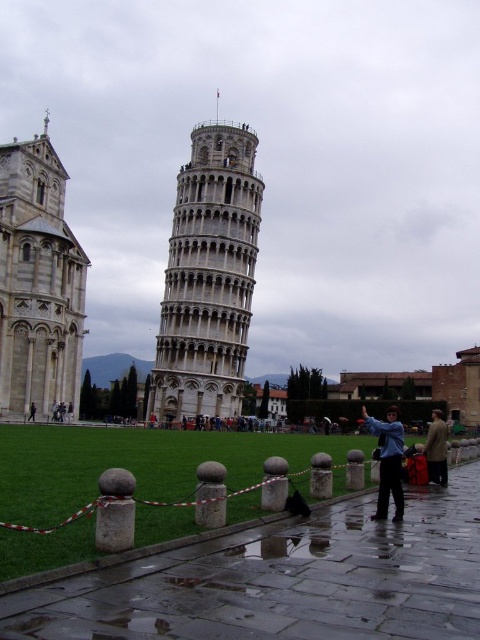
Can you confirm if stone tower at center is positioned to the right of dark blue jeans at center?

Yes, stone tower at center is to the right of dark blue jeans at center.

Which is above, stone tower at center or dark blue jeans at center?

Positioned higher is stone tower at center.

Locate an element on the screen. This screenshot has height=640, width=480. stone tower at center is located at coordinates (208, 276).

Between blue fabric jacket at center and dark blue jeans at center, which one is positioned higher?

Positioned higher is dark blue jeans at center.

Find the location of a particular element. This screenshot has width=480, height=640. blue fabric jacket at center is located at coordinates (387, 461).

Between point (384, 486) and point (35, 417), which one is positioned in front?

Point (384, 486) is in front.

Identify the location of blue fabric jacket at center. (387, 461).

Does stone tower at center come behind white stone bell tower at left?

Yes.

Is point (204, 355) closer to viewer compared to point (44, 230)?

No.

Describe the element at coordinates (208, 276) in the screenshot. I see `stone tower at center` at that location.

The image size is (480, 640). I want to click on stone tower at center, so 208,276.